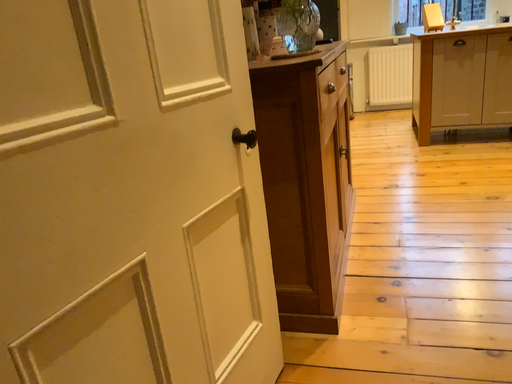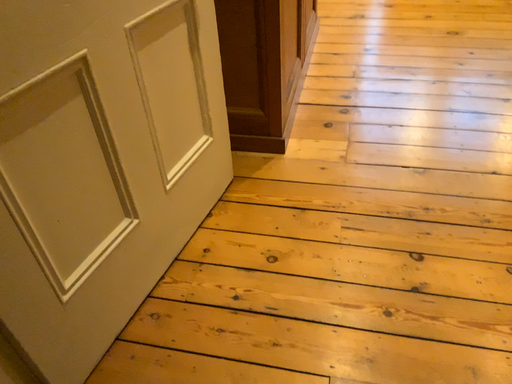
Question: Which way did the camera rotate in the video?

Choices:
 (A) rotated downward
 (B) rotated upward

Answer: (A)